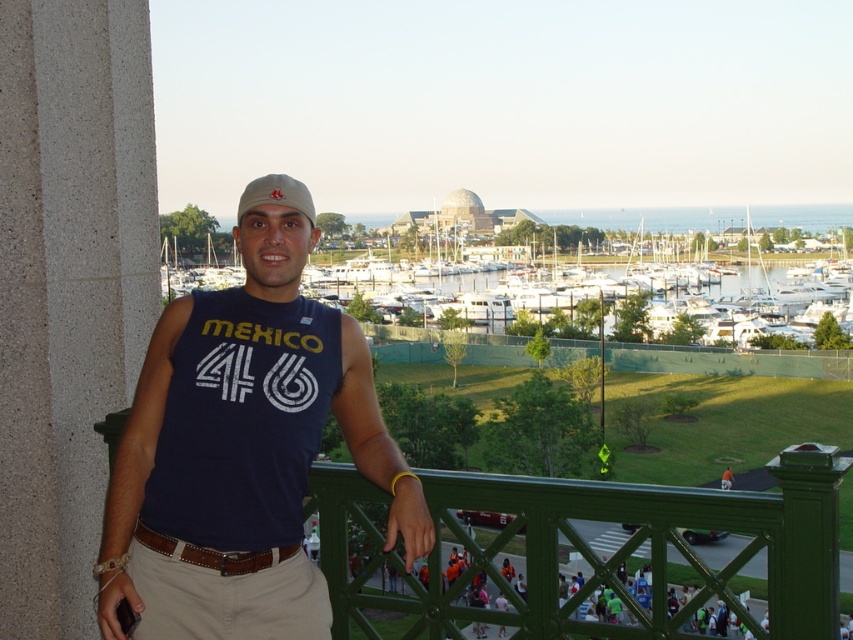
You are designing a virtual tour of this balcony scene. To place a virtual arrow pointing to the matte blue tank top at center, what are the coordinates you should use?

The coordinates for the matte blue tank top at center are at point (242, 452).

You are a fashion stylist observing a person on a balcony. The person is wearing a matte blue tank top at center and a matte beige cap at center. Which clothing item is positioned lower on their body?

The matte blue tank top at center is below the matte beige cap at center, so it is positioned lower on their body.